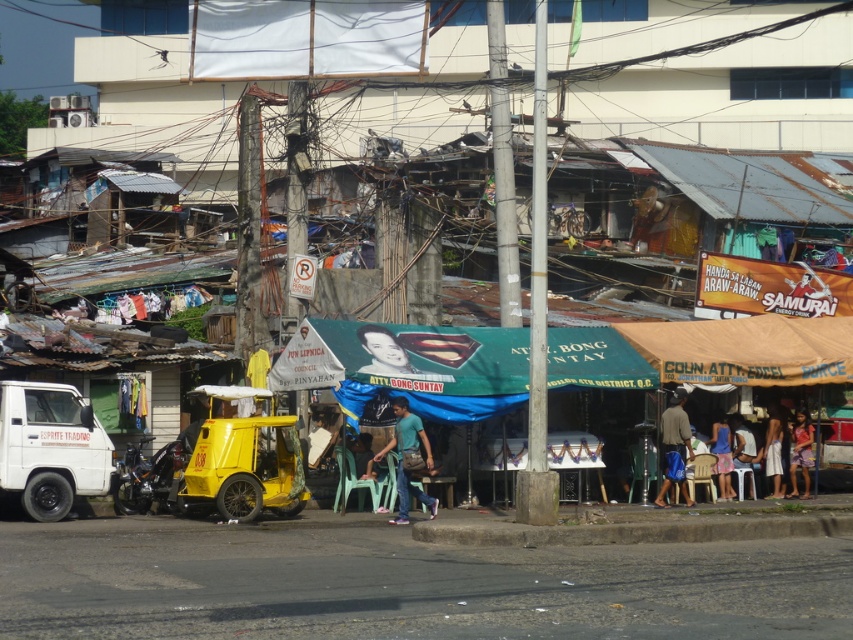
You are a photographer standing in the middle of the street. You want to take a photo that includes both the light blue denim jeans at center and the blue fabric dress at center. Which object should you focus on first to ensure both are in clear view?

You should focus on the light blue denim jeans at center first since it is closer to the viewer than the blue fabric dress at center. By focusing on the closer object, the depth of field may naturally include the farther one in acceptable focus.

You are a photographer trying to capture both the dark brown fabric pants at center and the light pink fabric dress at lower right in a single shot. Which one should you focus on first to ensure both are in the frame?

You should focus on the dark brown fabric pants at center first since it is in front of the light pink fabric dress at lower right, ensuring both are captured in the frame.

You are a delivery person standing at the yellow auto rickshaw parked on the left side of the road. You need to deliver a package to the SAMURAI ENERGY DR. banner. There are two points marked on the path to the banner. One is at point [682,428] and the other at point [730,490]. Which point is closer to the SAMURAI ENERGY DR. banner?

Point [730,490] is closer to the SAMURAI ENERGY DR. banner because point [682,428] is in front of it, meaning it is further away from the banner.